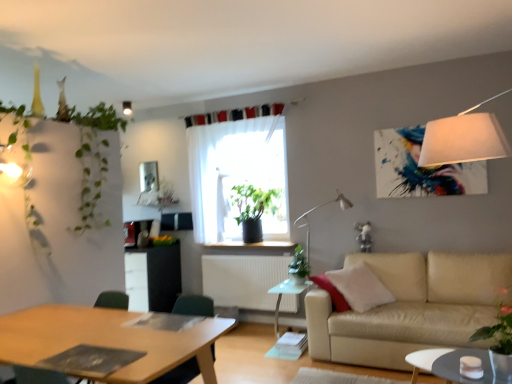
Question: Is beige leather couch at lower right closer to the viewer compared to green matte plant at center, which appears as the 2th plant when viewed from the back?

Choices:
 (A) yes
 (B) no

Answer: (A)

Question: Can you confirm if beige leather couch at lower right is thinner than green matte plant at center, which is the 3th plant from right to left?

Choices:
 (A) yes
 (B) no

Answer: (B)

Question: Is beige leather couch at lower right not inside green matte plant at center, which appears as the 2th plant when viewed from the back?

Choices:
 (A) no
 (B) yes

Answer: (B)

Question: Considering the relative positions of beige leather couch at lower right and green matte plant at center, which appears as the third plant when viewed from the left, in the image provided, is beige leather couch at lower right behind green matte plant at center, which appears as the third plant when viewed from the left,?

Choices:
 (A) no
 (B) yes

Answer: (A)

Question: Does beige leather couch at lower right appear on the left side of green matte plant at center, arranged as the 4th plant when viewed from the front?

Choices:
 (A) no
 (B) yes

Answer: (A)

Question: Is green plastic swivel chair at lower left in front of or behind sheer white curtain at center in the image?

Choices:
 (A) front
 (B) behind

Answer: (A)

Question: In terms of size, does green plastic swivel chair at lower left appear bigger or smaller than sheer white curtain at center?

Choices:
 (A) small
 (B) big

Answer: (A)

Question: From the image's perspective, is green plastic swivel chair at lower left above or below sheer white curtain at center?

Choices:
 (A) above
 (B) below

Answer: (B)

Question: Is green plastic swivel chair at lower left inside the boundaries of sheer white curtain at center, or outside?

Choices:
 (A) inside
 (B) outside

Answer: (B)

Question: Considering the positions of wooden desk at lower left and green matte plant at center, which is the 3th plant from right to left, in the image, is wooden desk at lower left bigger or smaller than green matte plant at center, which is the 3th plant from right to left,?

Choices:
 (A) small
 (B) big

Answer: (B)

Question: Is wooden desk at lower left wider or thinner than green matte plant at center, which appears as the 2th plant when viewed from the back?

Choices:
 (A) wide
 (B) thin

Answer: (A)

Question: Is wooden desk at lower left in front of or behind green matte plant at center, which appears as the third plant when viewed from the left, in the image?

Choices:
 (A) behind
 (B) front

Answer: (B)

Question: Is point (4, 362) positioned closer to the camera than point (273, 213)?

Choices:
 (A) closer
 (B) farther

Answer: (A)

Question: Is point (247, 158) closer or farther from the camera than point (86, 228)?

Choices:
 (A) farther
 (B) closer

Answer: (A)

Question: Considering their positions, is sheer white curtain at center located in front of or behind green leafy plant at upper left, which is the first plant from left to right?

Choices:
 (A) behind
 (B) front

Answer: (A)